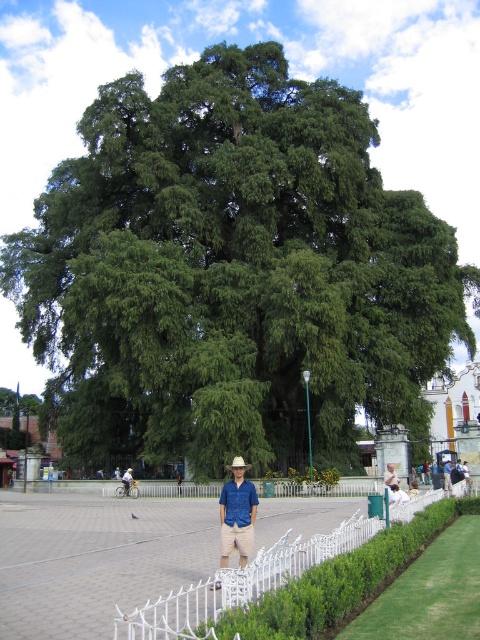
Question: Is green leafy tree at center above white wrought iron fence at lower right?

Choices:
 (A) no
 (B) yes

Answer: (B)

Question: Based on their relative distances, which object is nearer to the white wrought iron fence at lower right?

Choices:
 (A) green leafy tree at center
 (B) blue fabric shirt at center
 (C) blue denim shirt at center

Answer: (B)

Question: Which point is closer to the camera?

Choices:
 (A) green leafy tree at center
 (B) white wrought iron fence at lower right

Answer: (B)

Question: Considering the real-world distances, which object is closest to the green leafy tree at center?

Choices:
 (A) blue denim shirt at center
 (B) white wrought iron fence at lower right

Answer: (A)

Question: Observing the image, what is the correct spatial positioning of white wrought iron fence at lower right in reference to blue denim shirt at center?

Choices:
 (A) below
 (B) above

Answer: (B)

Question: Is white wrought iron fence at lower right behind blue fabric shirt at center?

Choices:
 (A) no
 (B) yes

Answer: (A)